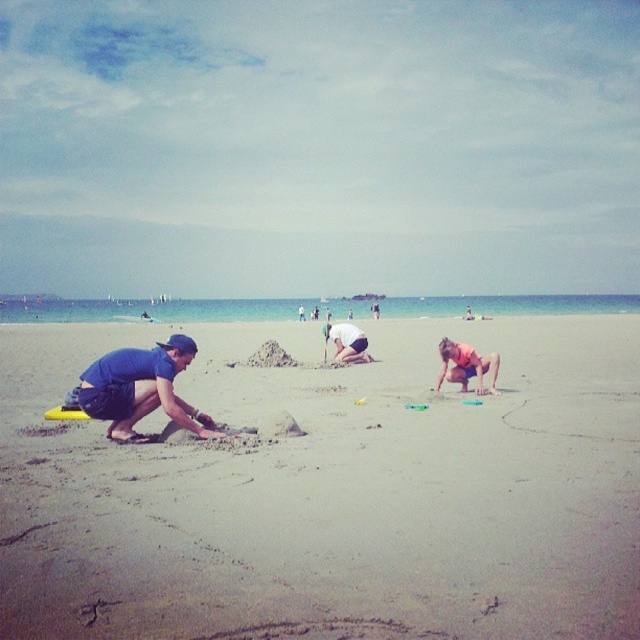
Question: Which point appears farthest from the camera in this image?

Choices:
 (A) (362, 352)
 (B) (145, 404)
 (C) (408, 465)

Answer: (A)

Question: Considering the relative positions of blue fabric shirt at lower left and orange fabric shorts at lower right in the image provided, where is blue fabric shirt at lower left located with respect to orange fabric shorts at lower right?

Choices:
 (A) right
 (B) left

Answer: (B)

Question: Which of the following is the closest to the observer?

Choices:
 (A) (333, 324)
 (B) (490, 371)

Answer: (B)

Question: From the image, what is the correct spatial relationship of sandy beach at lower left in relation to orange fabric shorts at lower right?

Choices:
 (A) above
 (B) below

Answer: (B)

Question: Is sandy beach at lower left to the left of matte blue shorts at center from the viewer's perspective?

Choices:
 (A) no
 (B) yes

Answer: (B)

Question: Which object is the closest to the matte blue shorts at center?

Choices:
 (A) blue fabric shirt at lower left
 (B) orange fabric shorts at lower right
 (C) sandy beach at lower left

Answer: (B)